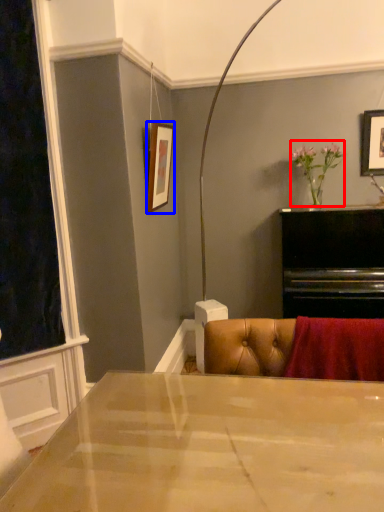
Question: Among these objects, which one is nearest to the camera, floral arrangement (highlighted by a red box) or picture frame (highlighted by a blue box)?

Choices:
 (A) floral arrangement
 (B) picture frame

Answer: (B)